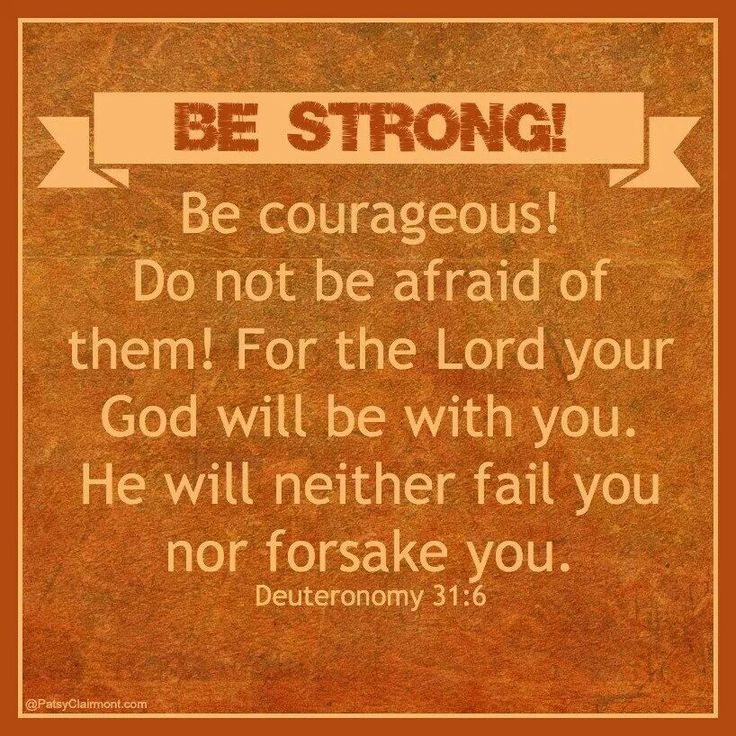
The height and width of the screenshot is (736, 736). Find the location of `bible book`. bible book is located at coordinates (346, 590).